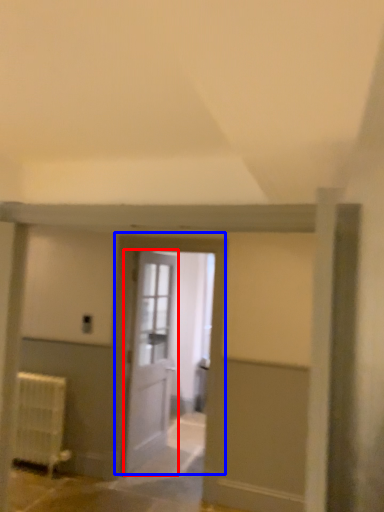
Question: Which object appears closest to the camera in this image, door (highlighted by a red box) or door (highlighted by a blue box)?

Choices:
 (A) door
 (B) door

Answer: (B)